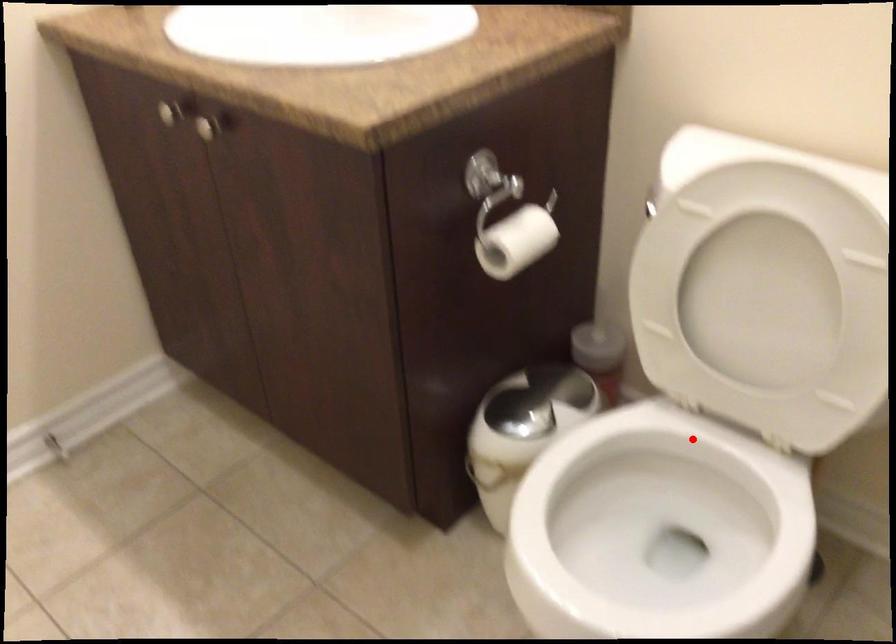
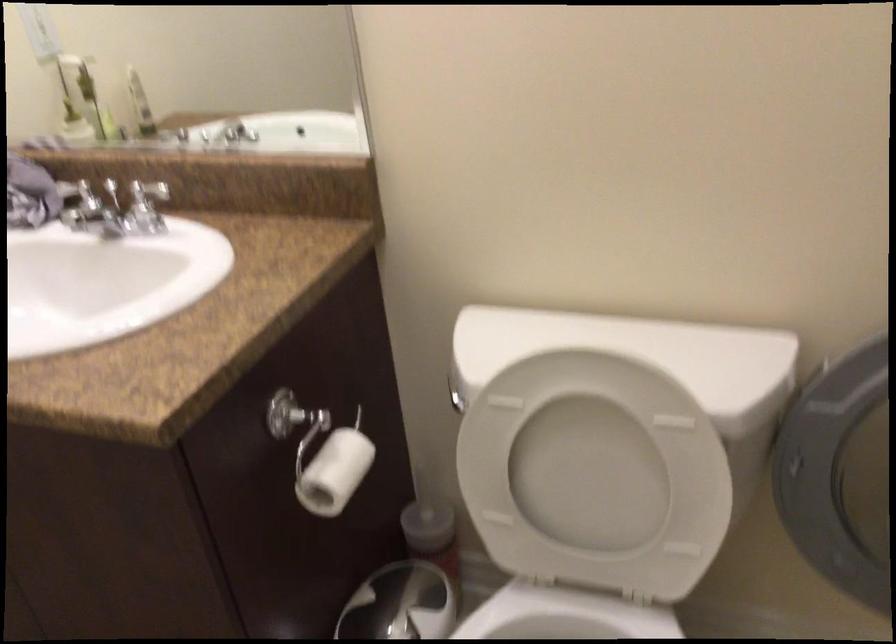
Where in the second image is the point corresponding to the highlighted location from the first image?

(564, 616)